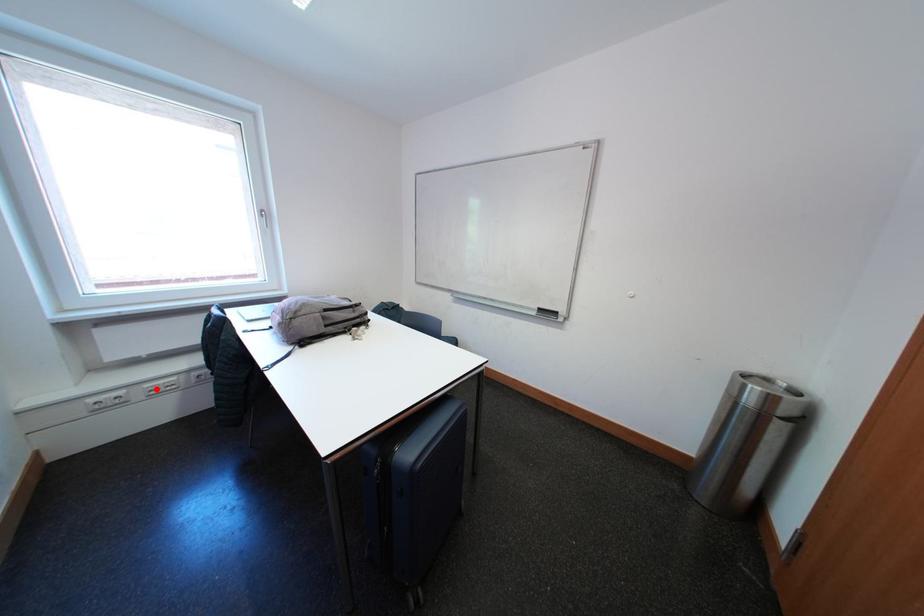
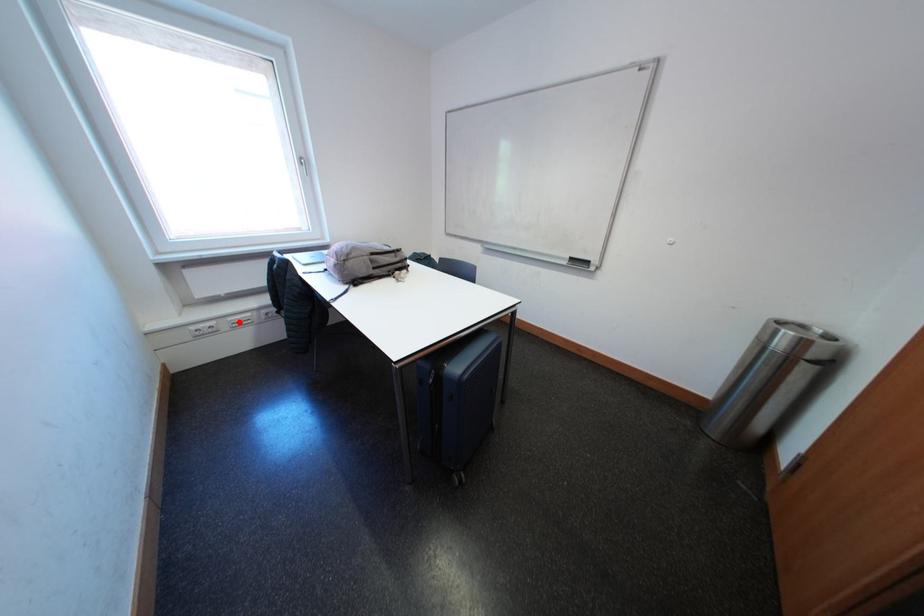
I am providing you with two images of the same scene from different viewpoints. A red point is marked on the first image and another point is marked on the second image. Do the highlighted points in image1 and image2 indicate the same real-world spot?

Yes